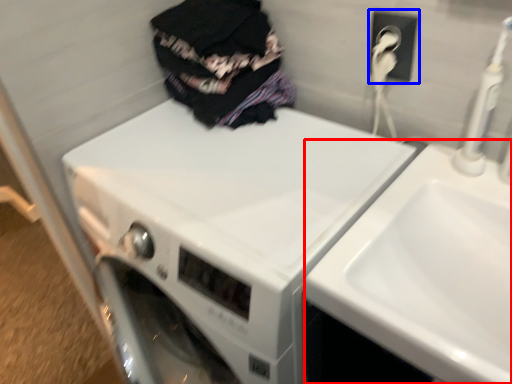
Question: Which object appears closest to the camera in this image, sink (highlighted by a red box) or electric outlet (highlighted by a blue box)?

Choices:
 (A) sink
 (B) electric outlet

Answer: (A)